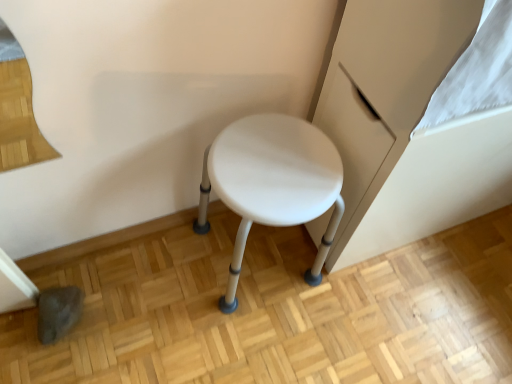
In order to face white matte stool at center, should I rotate leftwards or rightwards?

You should look right and rotate roughly 1.167 degrees.

At what (x,y) coordinates should I click in order to perform the action: click on white matte stool at center. Please return your answer as a coordinate pair (x, y). Looking at the image, I should click on (272, 183).

Describe the element at coordinates (272, 183) in the screenshot. The width and height of the screenshot is (512, 384). I see `white matte stool at center` at that location.

Consider the image. Measure the distance between white matte stool at center and camera.

The depth of white matte stool at center is 35.72 inches.

Identify the location of white matte stool at center. (272, 183).